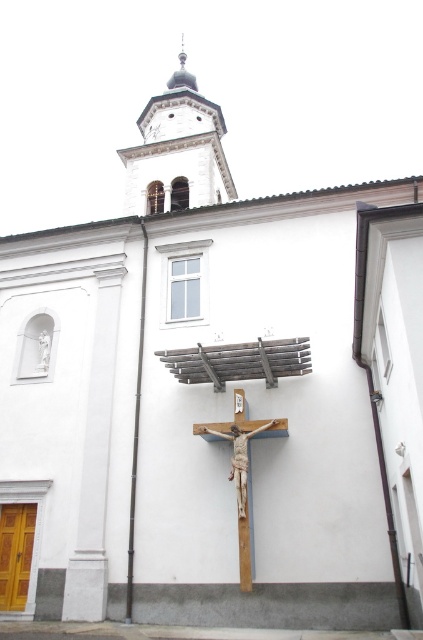
Question: Does smooth white stone spire at upper center have a smaller size compared to wooden cross at center?

Choices:
 (A) no
 (B) yes

Answer: (A)

Question: Does smooth white stone spire at upper center appear over wooden cross at center?

Choices:
 (A) yes
 (B) no

Answer: (A)

Question: Which point is closer to the camera taking this photo?

Choices:
 (A) (242, 432)
 (B) (181, 90)

Answer: (A)

Question: Is smooth white stone spire at upper center closer to the viewer compared to wooden cross at center?

Choices:
 (A) yes
 (B) no

Answer: (B)